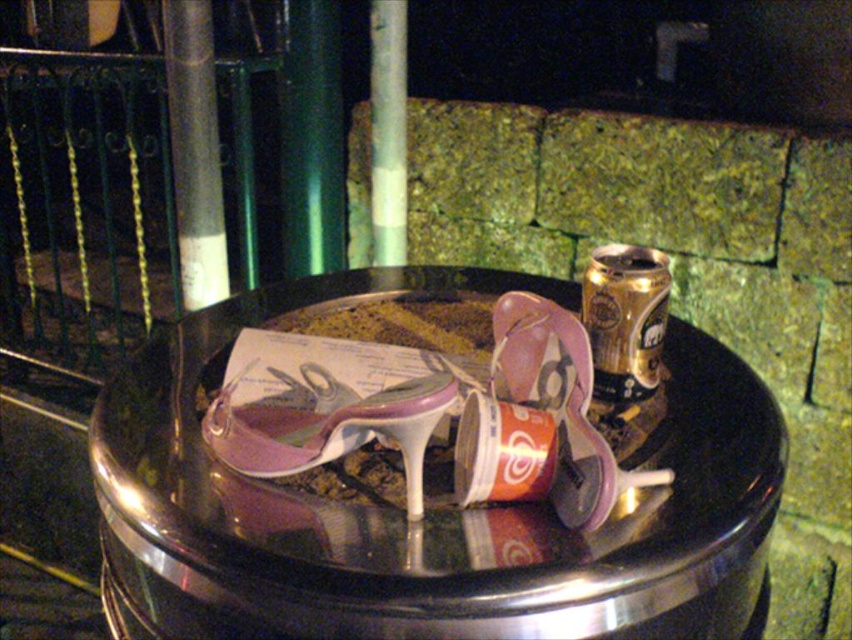
Consider the image. You are standing at the origin point in the image and want to reach the point at the back. Which coordinate should you head towards, point at (216,433) or point at (562,426)?

Point at (216,433) is behind point at (562,426), so you should head towards point at (216,433).